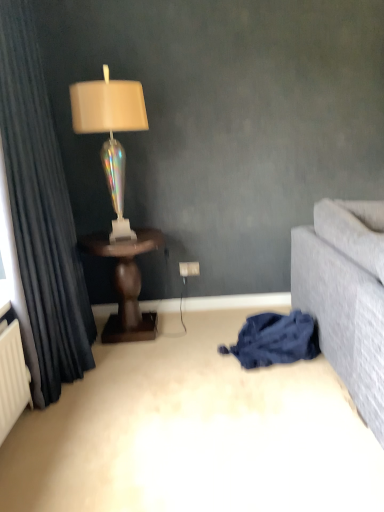
Question: Is iridescent glass lamp at left bigger than dark grey velvet curtain at left?

Choices:
 (A) yes
 (B) no

Answer: (B)

Question: Is iridescent glass lamp at left smaller than dark grey velvet curtain at left?

Choices:
 (A) no
 (B) yes

Answer: (B)

Question: Is the depth of iridescent glass lamp at left less than that of dark grey velvet curtain at left?

Choices:
 (A) yes
 (B) no

Answer: (B)

Question: Is iridescent glass lamp at left positioned behind dark grey velvet curtain at left?

Choices:
 (A) yes
 (B) no

Answer: (A)

Question: Can you confirm if iridescent glass lamp at left is taller than dark grey velvet curtain at left?

Choices:
 (A) no
 (B) yes

Answer: (A)

Question: Is iridescent glass lamp at left thinner than dark grey velvet curtain at left?

Choices:
 (A) no
 (B) yes

Answer: (A)

Question: Can you confirm if iridescent glass lamp at left is wider than blue cotton blanket at lower right?

Choices:
 (A) no
 (B) yes

Answer: (A)

Question: Is iridescent glass lamp at left touching blue cotton blanket at lower right?

Choices:
 (A) yes
 (B) no

Answer: (B)

Question: From a real-world perspective, is iridescent glass lamp at left physically above blue cotton blanket at lower right?

Choices:
 (A) no
 (B) yes

Answer: (B)

Question: Can you confirm if iridescent glass lamp at left is positioned to the left of blue cotton blanket at lower right?

Choices:
 (A) no
 (B) yes

Answer: (B)

Question: Is iridescent glass lamp at left bigger than blue cotton blanket at lower right?

Choices:
 (A) no
 (B) yes

Answer: (B)

Question: Is iridescent glass lamp at left positioned before blue cotton blanket at lower right?

Choices:
 (A) no
 (B) yes

Answer: (A)

Question: From the image's perspective, is blue cotton blanket at lower right over dark wood table at left?

Choices:
 (A) no
 (B) yes

Answer: (A)